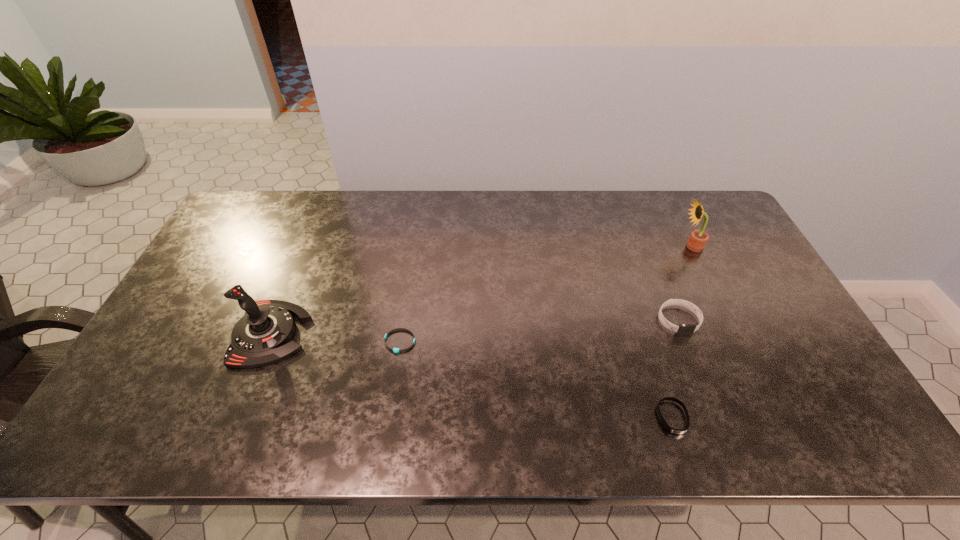
Identify the location of vacant area at the far left corner. (254, 193).

The height and width of the screenshot is (540, 960). In the image, there is a desktop. Identify the location of vacant space at the far right corner. (722, 210).

Where is `free point between the fourth tallest object and the leftmost object`? free point between the fourth tallest object and the leftmost object is located at coordinates click(x=471, y=375).

Image resolution: width=960 pixels, height=540 pixels. I want to click on free space between the tallest wristband and the second shortest object, so click(675, 369).

Identify the location of free space between the farthest object and the joystick. (x=481, y=290).

Locate an element on the screen. This screenshot has width=960, height=540. free space between the second object from left to right and the leftmost object is located at coordinates (335, 338).

I want to click on free spot between the tallest wristband and the nearest object, so click(675, 369).

You are a GUI agent. You are given a task and a screenshot of the screen. Output one action in this format:
    pyautogui.click(x=<x>, y=<y>)
    Task: Click on the free spot between the fourth object from right to left and the leftmost object
    Image resolution: width=960 pixels, height=540 pixels.
    Given the screenshot: What is the action you would take?
    pyautogui.click(x=335, y=338)

Locate an element on the screen. vacant area that lies between the farthest object and the joystick is located at coordinates (481, 290).

What are the coordinates of `vacant area that lies between the nearest object and the leftmost object` in the screenshot? It's located at (471, 375).